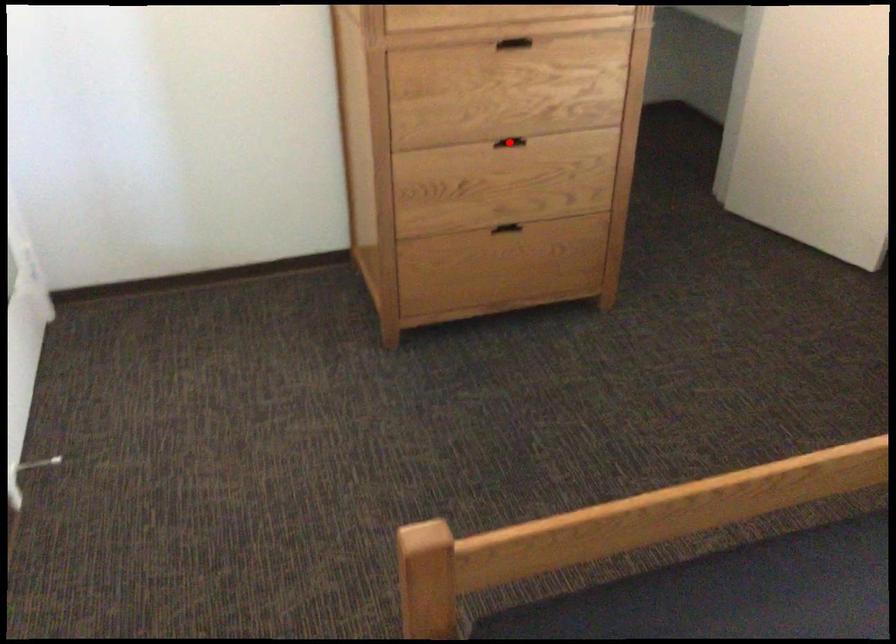
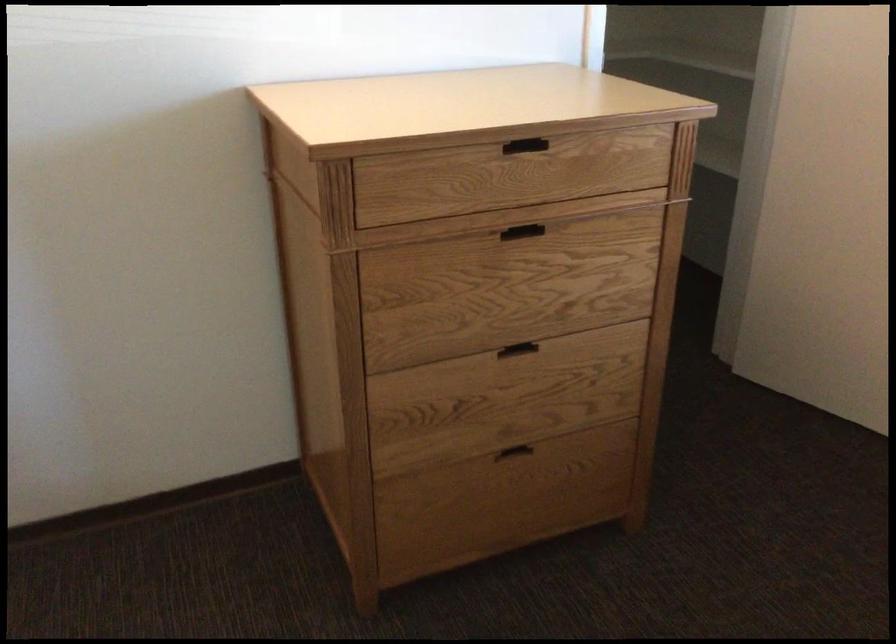
Question: I am providing you with two images of the same scene from different viewpoints. A red point is marked on the first image. At the location where the point appears in image 1, is it still visible in image 2?

Choices:
 (A) Yes
 (B) No

Answer: (B)